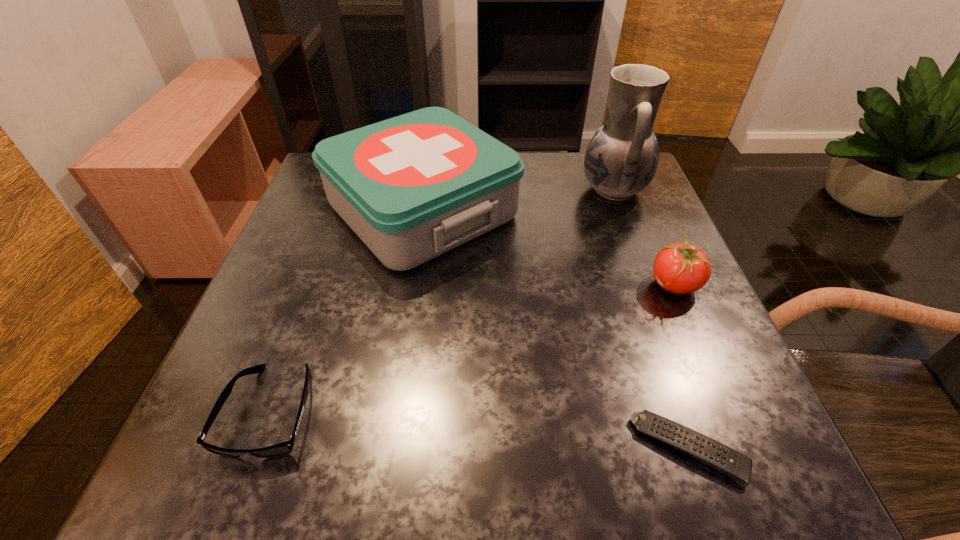
Find the location of a particular element. The height and width of the screenshot is (540, 960). free space located on the back of the remote control is located at coordinates (650, 333).

Where is `pitcher located in the far edge section of the desktop`? The width and height of the screenshot is (960, 540). pitcher located in the far edge section of the desktop is located at coordinates (621, 159).

Locate an element on the screen. This screenshot has height=540, width=960. the first-aid kit that is at the far edge is located at coordinates (412, 187).

Locate an element on the screen. The height and width of the screenshot is (540, 960). sunglasses located at the near edge is located at coordinates (284, 448).

I want to click on remote control at the near edge, so click(x=726, y=460).

Where is `the first-aid kit that is at the left edge`? This screenshot has height=540, width=960. the first-aid kit that is at the left edge is located at coordinates (412, 187).

At what (x,y) coordinates should I click in order to perform the action: click on sunglasses located in the left edge section of the desktop. Please return your answer as a coordinate pair (x, y). Looking at the image, I should click on [x=284, y=448].

Find the location of a particular element. pitcher that is positioned at the right edge is located at coordinates (621, 159).

This screenshot has width=960, height=540. What are the coordinates of `tomato that is at the right edge` in the screenshot? It's located at (681, 268).

Locate an element on the screen. The width and height of the screenshot is (960, 540). remote control that is positioned at the right edge is located at coordinates (726, 460).